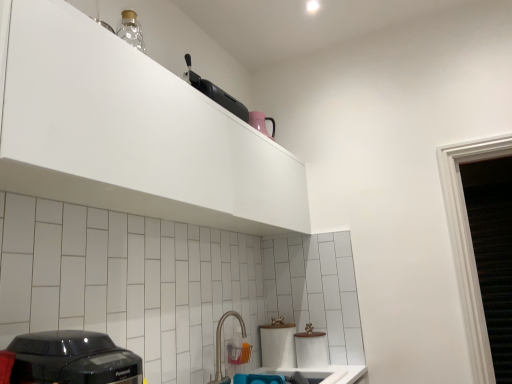
Question: Is satin nickel faucet at lower center wider or thinner than black plastic toaster at lower left?

Choices:
 (A) thin
 (B) wide

Answer: (A)

Question: Is satin nickel faucet at lower center inside or outside of black plastic toaster at lower left?

Choices:
 (A) inside
 (B) outside

Answer: (B)

Question: Which object is the farthest from the white matte cabinet at upper center?

Choices:
 (A) black plastic toaster at lower left
 (B) satin nickel faucet at lower center
 (C) black plastic toaster at upper center
 (D) white glossy sink at lower center

Answer: (D)

Question: Based on their relative distances, which object is farther from the black plastic toaster at upper center?

Choices:
 (A) black plastic toaster at lower left
 (B) white matte cabinet at upper center
 (C) white glossy sink at lower center
 (D) satin nickel faucet at lower center

Answer: (C)